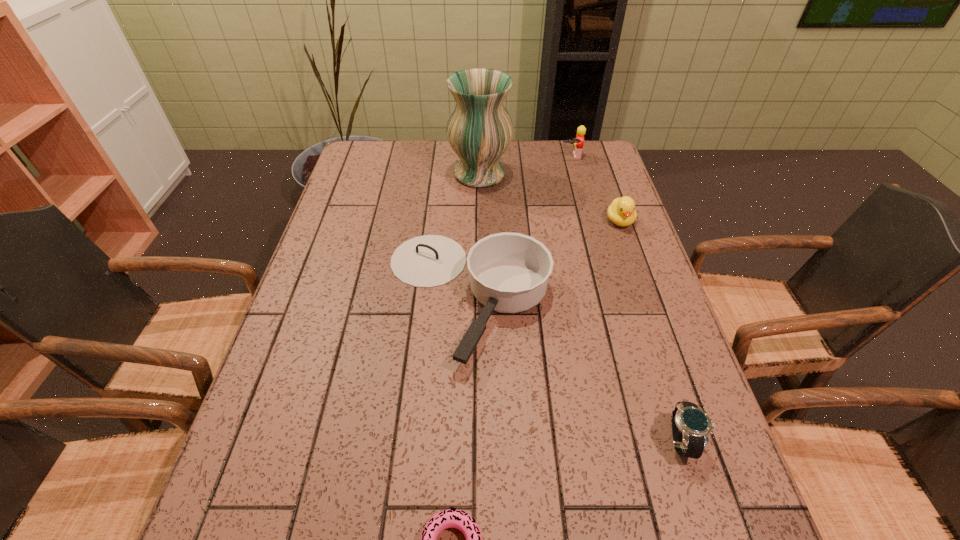
Image resolution: width=960 pixels, height=540 pixels. What are the coordinates of `vase situated at the far edge` in the screenshot? It's located at (479, 129).

Locate an element on the screen. The width and height of the screenshot is (960, 540). Lego positioned at the far edge is located at coordinates (577, 142).

Locate an element on the screen. The height and width of the screenshot is (540, 960). Lego that is at the right edge is located at coordinates (577, 142).

This screenshot has height=540, width=960. I want to click on duckling that is at the right edge, so click(x=621, y=212).

Find the location of a particular element. watch at the right edge is located at coordinates (691, 426).

Image resolution: width=960 pixels, height=540 pixels. I want to click on object present at the far right corner, so click(577, 142).

Locate an element on the screen. Image resolution: width=960 pixels, height=540 pixels. vacant space at the far edge is located at coordinates (421, 142).

Where is `vacant area at the left edge`? The width and height of the screenshot is (960, 540). vacant area at the left edge is located at coordinates (294, 458).

Find the location of `vacant area at the right edge`. vacant area at the right edge is located at coordinates (625, 314).

In the image, there is a desktop. Where is `vacant area at the far left corner`? The width and height of the screenshot is (960, 540). vacant area at the far left corner is located at coordinates (353, 154).